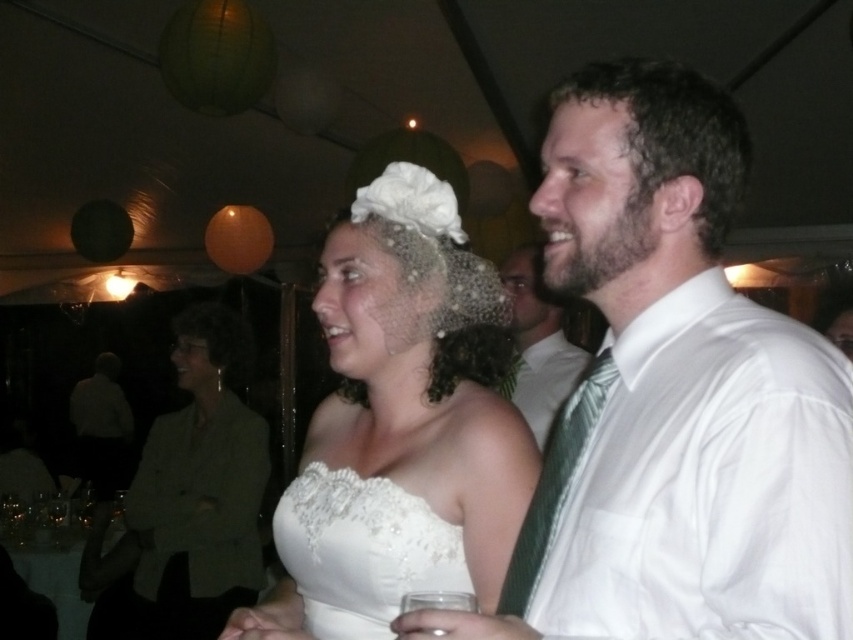
Question: Does matte olive green blazer at center lie behind white satin shirt at right?

Choices:
 (A) no
 (B) yes

Answer: (B)

Question: Does white satin dress shirt at right come behind white lace dress at center?

Choices:
 (A) no
 (B) yes

Answer: (A)

Question: Which point is farther to the camera?

Choices:
 (A) green silk tie at right
 (B) white satin dress at center
 (C) matte olive green blazer at center

Answer: (C)

Question: Is white satin shirt at center positioned at the back of white satin shirt at right?

Choices:
 (A) yes
 (B) no

Answer: (B)

Question: Which point is farther from the camera taking this photo?

Choices:
 (A) (556, 449)
 (B) (180, 554)
 (C) (418, 460)
 (D) (610, 300)

Answer: (B)

Question: Which point is farther to the camera?

Choices:
 (A) (415, 541)
 (B) (791, 396)
 (C) (357, 545)
 (D) (749, 352)

Answer: (C)